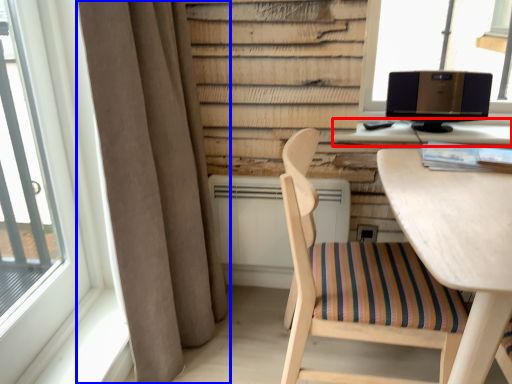
Question: Which point is closer to the camera, computer (highlighted by a red box) or curtain (highlighted by a blue box)?

Choices:
 (A) computer
 (B) curtain

Answer: (B)